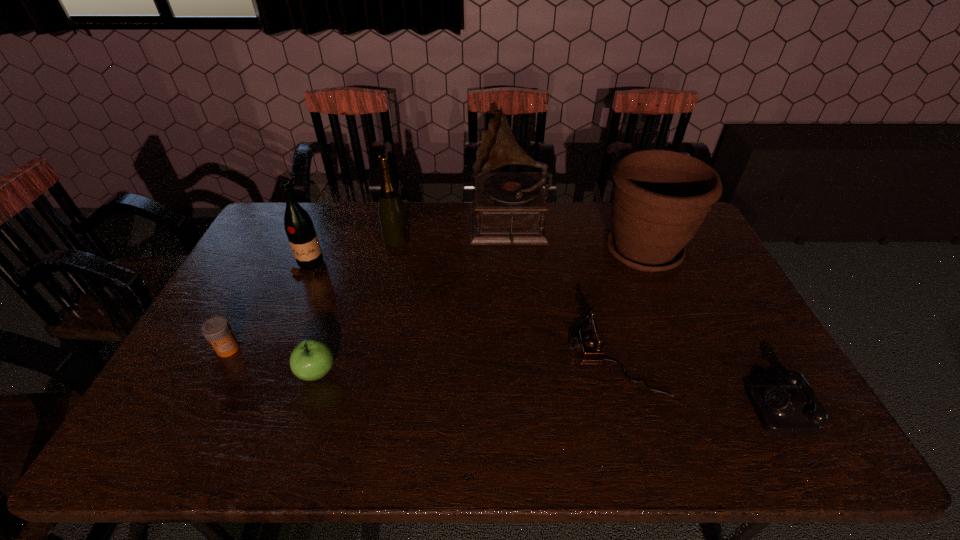
Where is `blank space located 0.080m on the label side of the leftmost object`? blank space located 0.080m on the label side of the leftmost object is located at coordinates (210, 384).

Where is `free region located on the dial of the right telephone`? Image resolution: width=960 pixels, height=540 pixels. free region located on the dial of the right telephone is located at coordinates (631, 401).

At what (x,y) coordinates should I click in order to perform the action: click on vacant area situated on the dial of the right telephone. Please return your answer as a coordinate pair (x, y). Looking at the image, I should click on (676, 401).

Locate an element on the screen. Image resolution: width=960 pixels, height=540 pixels. vacant space situated 0.310m on the dial of the right telephone is located at coordinates (623, 401).

You are a GUI agent. You are given a task and a screenshot of the screen. Output one action in this format:
    pyautogui.click(x=<x>, y=<y>)
    Task: Click on the record player present at the far edge
    
    Given the screenshot: What is the action you would take?
    pyautogui.click(x=509, y=207)

Locate an element on the screen. The width and height of the screenshot is (960, 540). wine bottle at the far edge is located at coordinates (392, 215).

The width and height of the screenshot is (960, 540). In order to click on flowerpot at the far edge in this screenshot , I will do `click(660, 198)`.

Find the location of `object at the near edge`. object at the near edge is located at coordinates (782, 409).

Identify the location of object located in the left edge section of the desktop. (217, 330).

I want to click on flowerpot situated at the right edge, so click(660, 198).